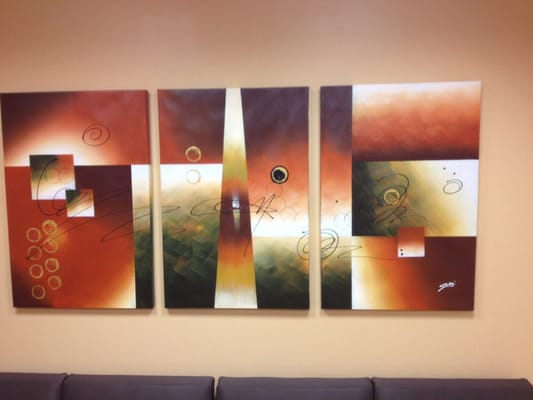
I want to click on brown paint, so click(x=271, y=114).